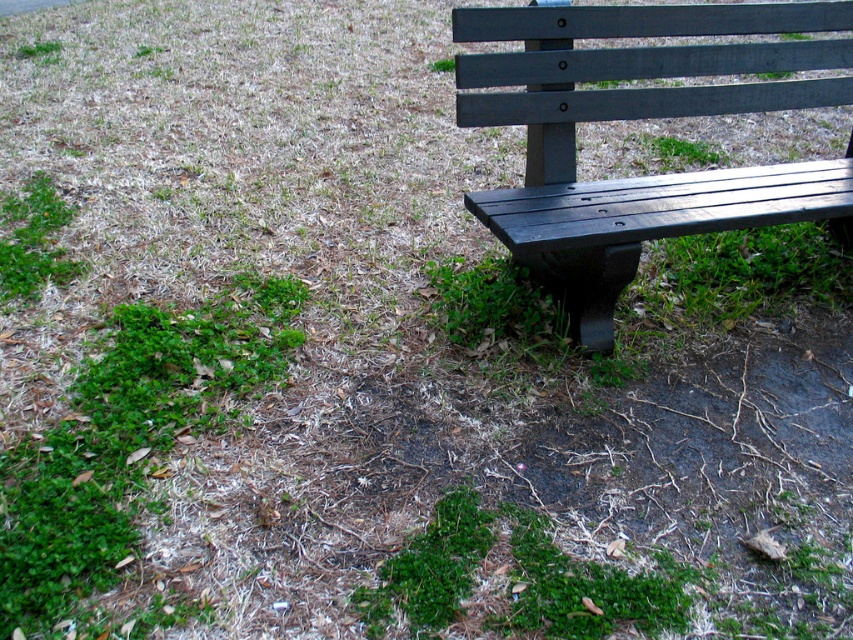
Question: Does matte black bench at right have a larger size compared to green leafy grass at lower left?

Choices:
 (A) no
 (B) yes

Answer: (B)

Question: Is matte black bench at right thinner than green leafy grass at lower left?

Choices:
 (A) no
 (B) yes

Answer: (A)

Question: In this image, where is matte black bench at right located relative to green leafy grass at lower left?

Choices:
 (A) left
 (B) right

Answer: (B)

Question: Which point is farther to the camera?

Choices:
 (A) (68, 508)
 (B) (608, 77)

Answer: (B)

Question: Which object is closer to the camera taking this photo?

Choices:
 (A) green leafy grass at lower left
 (B) matte black bench at right

Answer: (A)